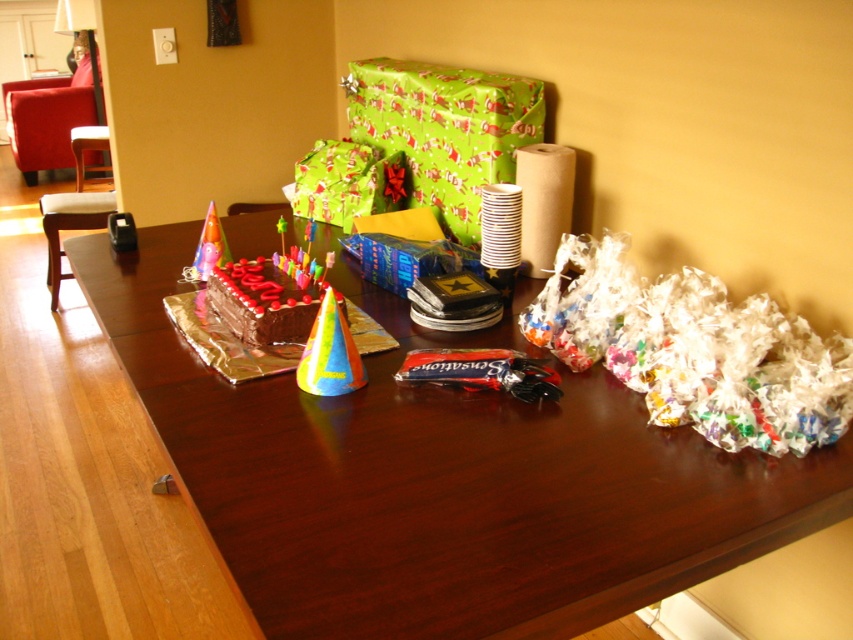
You are standing at the edge of the table and want to reach both the point at (440, 72) and the point at (543, 168). Which point should you reach for first to minimize the distance traveled?

You should reach for point (543, 168) first because it is closer to you than point (440, 72), which is further away.

You are standing 4 feet away from the dining table. You want to reach a specific point on the table marked as point (x=747, y=339). Can you comfortably reach it without moving closer?

The distance of point (x=747, y=339) from viewer is 3.80 feet, so yes, you can comfortably reach it since it is within your 4 feet range.

Based on the photo, you are a guest at the birthday party and want to place a gift on the table. The gift is too heavy to lift, so you need to slide it from the edge of the table towards the center. You start sliding it from the edge near point A at coordinates point[482,74] and want to move it towards the center. Will the gift pass in front of point B at coordinates point[204,272]?

Since point[482,74] is behind point[204,272], sliding the gift from point[482,74] towards the center will move it forward past point[204,272]. Therefore, the gift will pass in front of point B at coordinates point[204,272].